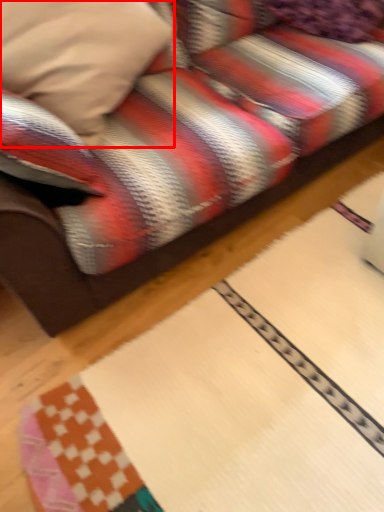
Question: Considering the relative positions of pillow (annotated by the red box) and pillow in the image provided, where is pillow (annotated by the red box) located with respect to the staircase?

Choices:
 (A) right
 (B) left

Answer: (B)